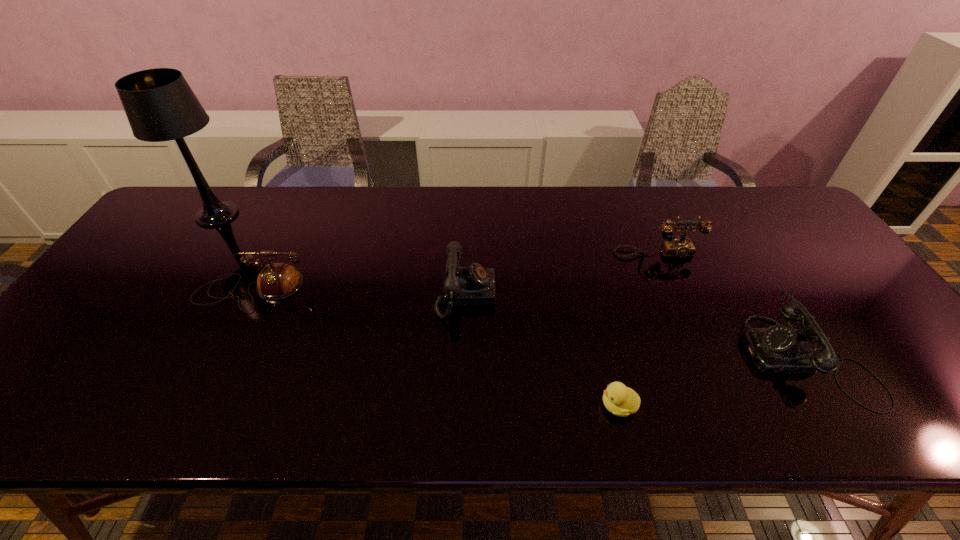
Locate an element on the screen. vacant space that is in between the leftmost telephone and the duckling is located at coordinates (435, 347).

The image size is (960, 540). What are the coordinates of `object that can be found as the fifth closest to the farthest telephone` in the screenshot? It's located at (160, 106).

Point out which object is positioned as the fifth nearest to the table lamp. Please provide its 2D coordinates. Your answer should be formatted as a tuple, i.e. [(x, y)], where the tuple contains the x and y coordinates of a point satisfying the conditions above.

[(780, 349)]

Identify which telephone is located as the second nearest to the third telephone from right to left. Please provide its 2D coordinates. Your answer should be formatted as a tuple, i.e. [(x, y)], where the tuple contains the x and y coordinates of a point satisfying the conditions above.

[(277, 280)]

The image size is (960, 540). I want to click on telephone that stands as the closest to the fourth object from right to left, so click(x=680, y=247).

At what (x,y) coordinates should I click in order to perform the action: click on free space that satisfies the following two spatial constraints: 1. on the front-facing side of the farthest telephone; 2. at the beak of the duckling. Please return your answer as a coordinate pair (x, y). The width and height of the screenshot is (960, 540). Looking at the image, I should click on (722, 406).